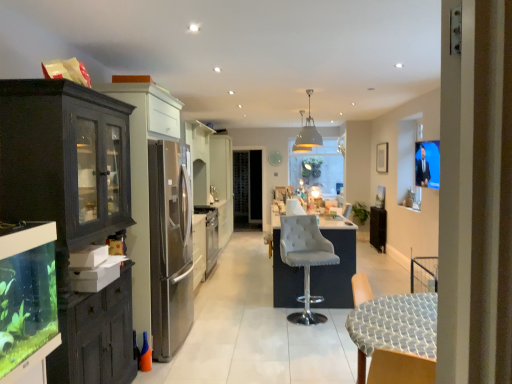
The image size is (512, 384). What do you see at coordinates (210, 236) in the screenshot? I see `satin silver oven at center` at bounding box center [210, 236].

What do you see at coordinates (27, 301) in the screenshot?
I see `clear glass aquarium at left` at bounding box center [27, 301].

Find the location of `satin silver oven at center`. satin silver oven at center is located at coordinates (210, 236).

From a real-world perspective, who is located lower, wooden chair at lower right, which appears as the 1th chair when viewed from the front, or suede-like white bar stool at center, acting as the second chair starting from the front?

wooden chair at lower right, which appears as the 1th chair when viewed from the front.

Is point (352, 283) closer to viewer compared to point (295, 251)?

That is False.

Looking at this image, could you tell me if wooden chair at lower right, which appears as the 1th chair when viewed from the front, is facing suede-like white bar stool at center, acting as the second chair starting from the front?

No, wooden chair at lower right, which appears as the 1th chair when viewed from the front, is not facing towards suede-like white bar stool at center, acting as the second chair starting from the front.

In the scene shown: Which object is positioned more to the left, wooden chair at lower right, arranged as the second chair when viewed from the back, or suede-like white bar stool at center, marked as the first chair in a back-to-front arrangement?

suede-like white bar stool at center, marked as the first chair in a back-to-front arrangement, is more to the left.

Considering the positions of objects clear glass aquarium at left and satin silver oven at center in the image provided, who is more to the right, clear glass aquarium at left or satin silver oven at center?

satin silver oven at center.

From the image's perspective, is clear glass aquarium at left above or below satin silver oven at center?

clear glass aquarium at left is above satin silver oven at center.

Does clear glass aquarium at left come in front of satin silver oven at center?

Yes, it is.

Considering the points (39, 281) and (216, 220), which point is behind, point (39, 281) or point (216, 220)?

The point (216, 220) is farther from the camera.

Can you confirm if matte white pendant light at upper center, arranged as the first lamp when viewed from the front, is positioned to the right of clear glass aquarium at left?

Indeed, matte white pendant light at upper center, arranged as the first lamp when viewed from the front, is positioned on the right side of clear glass aquarium at left.

Does matte white pendant light at upper center, arranged as the first lamp when viewed from the front, have a greater height compared to clear glass aquarium at left?

Indeed, matte white pendant light at upper center, arranged as the first lamp when viewed from the front, has a greater height compared to clear glass aquarium at left.

Is matte white pendant light at upper center, arranged as the first lamp when viewed from the front, situated inside clear glass aquarium at left or outside?

matte white pendant light at upper center, arranged as the first lamp when viewed from the front, is not enclosed by clear glass aquarium at left.

From the image's perspective, is matte white pendant light at upper center, arranged as the first lamp when viewed from the front, positioned above or below clear glass aquarium at left?

Clearly, from the image's perspective, matte white pendant light at upper center, arranged as the first lamp when viewed from the front, is above clear glass aquarium at left.

From a real-world perspective, relative to satin silver oven at center, is metallic gray pendant light at upper center, positioned as the first lamp in back-to-front order, vertically above or below?

Clearly, from a real-world perspective, metallic gray pendant light at upper center, positioned as the first lamp in back-to-front order, is above satin silver oven at center.

Is metallic gray pendant light at upper center, positioned as the first lamp in back-to-front order, facing towards satin silver oven at center?

No.

Can you confirm if metallic gray pendant light at upper center, the second lamp positioned from the front, is bigger than satin silver oven at center?

No.

How distant is metallic gray pendant light at upper center, the second lamp positioned from the front, from satin silver oven at center?

metallic gray pendant light at upper center, the second lamp positioned from the front, and satin silver oven at center are 10.65 feet apart.

How different are the orientations of clear glass aquarium at left and matte white pendant light at upper center, which is the second lamp from back to front, in degrees?

87.8 degrees.

Which point is more distant from viewer, (42,234) or (307,93)?

Point (307,93)

Relative to matte white pendant light at upper center, arranged as the first lamp when viewed from the front, is clear glass aquarium at left in front or behind?

In the image, clear glass aquarium at left appears in front of matte white pendant light at upper center, arranged as the first lamp when viewed from the front.

Is clear glass aquarium at left smaller than matte white pendant light at upper center, arranged as the first lamp when viewed from the front?

No, clear glass aquarium at left is not smaller than matte white pendant light at upper center, arranged as the first lamp when viewed from the front.

From the picture: In terms of size, does matte white pendant light at upper center, which is the second lamp from back to front, appear bigger or smaller than suede-like white bar stool at center, acting as the second chair starting from the front?

Considering their sizes, matte white pendant light at upper center, which is the second lamp from back to front, takes up less space than suede-like white bar stool at center, acting as the second chair starting from the front.

From the image's perspective, which one is positioned lower, matte white pendant light at upper center, arranged as the first lamp when viewed from the front, or suede-like white bar stool at center, acting as the second chair starting from the front?

suede-like white bar stool at center, acting as the second chair starting from the front, is shown below in the image.

Is matte white pendant light at upper center, arranged as the first lamp when viewed from the front, positioned behind suede-like white bar stool at center, acting as the second chair starting from the front?

Yes, matte white pendant light at upper center, arranged as the first lamp when viewed from the front, is further from the camera.

Would you consider matte white pendant light at upper center, arranged as the first lamp when viewed from the front, to be distant from suede-like white bar stool at center, marked as the first chair in a back-to-front arrangement?

Yes.

How many degrees apart are the facing directions of metallic gray pendant light at upper center, positioned as the first lamp in back-to-front order, and clear glass aquarium at left?

metallic gray pendant light at upper center, positioned as the first lamp in back-to-front order, and clear glass aquarium at left are facing 87.8 degrees away from each other.

Measure the distance between metallic gray pendant light at upper center, the second lamp positioned from the front, and clear glass aquarium at left.

metallic gray pendant light at upper center, the second lamp positioned from the front, and clear glass aquarium at left are 7.61 meters apart.

Based on the photo, is metallic gray pendant light at upper center, positioned as the first lamp in back-to-front order, to the left or to the right of clear glass aquarium at left in the image?

metallic gray pendant light at upper center, positioned as the first lamp in back-to-front order, is to the right of clear glass aquarium at left.

From a real-world perspective, is metallic gray pendant light at upper center, positioned as the first lamp in back-to-front order, under clear glass aquarium at left?

No, from a real-world perspective, metallic gray pendant light at upper center, positioned as the first lamp in back-to-front order, is not under clear glass aquarium at left.

Identify the location of chair below the suede-like white bar stool at center, acting as the second chair starting from the front (from a real-world perspective). (393, 335).

At what (x,y) coordinates should I click in order to perform the action: click on appliance that appears below the clear glass aquarium at left (from the image's perspective). Please return your answer as a coordinate pair (x, y). The image size is (512, 384). Looking at the image, I should click on (210, 236).

Which object lies nearer to the anchor point clear glass aquarium at left, matte white pendant light at upper center, arranged as the first lamp when viewed from the front, or metallic gray pendant light at upper center, the second lamp positioned from the front?

matte white pendant light at upper center, arranged as the first lamp when viewed from the front.

Looking at the image, which one is located further to clear glass aquarium at left, suede-like white bar stool at center, marked as the first chair in a back-to-front arrangement, or metallic gray pendant light at upper center, positioned as the first lamp in back-to-front order?

metallic gray pendant light at upper center, positioned as the first lamp in back-to-front order, is further to clear glass aquarium at left.

Based on the photo, considering their positions, is wooden chair at lower right, arranged as the second chair when viewed from the back, positioned closer to matte white pendant light at upper center, arranged as the first lamp when viewed from the front, than satin silver oven at center?

satin silver oven at center is positioned closer to the anchor matte white pendant light at upper center, arranged as the first lamp when viewed from the front.

Looking at the image, which one is located further to satin silver oven at center, matte white pendant light at upper center, arranged as the first lamp when viewed from the front, or wooden chair at lower right, which appears as the 1th chair when viewed from the front?

The object further to satin silver oven at center is wooden chair at lower right, which appears as the 1th chair when viewed from the front.

Looking at the image, which one is located further to clear glass aquarium at left, suede-like white bar stool at center, marked as the first chair in a back-to-front arrangement, or wooden chair at lower right, arranged as the second chair when viewed from the back?

suede-like white bar stool at center, marked as the first chair in a back-to-front arrangement, is further to clear glass aquarium at left.

Looking at the image, which one is located further to matte white pendant light at upper center, which is the second lamp from back to front, metallic gray pendant light at upper center, the second lamp positioned from the front, or satin silver oven at center?

satin silver oven at center is further to matte white pendant light at upper center, which is the second lamp from back to front.

Looking at the image, which one is located closer to suede-like white bar stool at center, marked as the first chair in a back-to-front arrangement, matte white pendant light at upper center, arranged as the first lamp when viewed from the front, or metallic gray pendant light at upper center, the second lamp positioned from the front?

matte white pendant light at upper center, arranged as the first lamp when viewed from the front, is positioned closer to the anchor suede-like white bar stool at center, marked as the first chair in a back-to-front arrangement.

Based on their spatial positions, is matte white pendant light at upper center, arranged as the first lamp when viewed from the front, or suede-like white bar stool at center, acting as the second chair starting from the front, further from satin silver oven at center?

matte white pendant light at upper center, arranged as the first lamp when viewed from the front, is positioned further to the anchor satin silver oven at center.

Locate an element on the screen. The image size is (512, 384). chair between wooden chair at lower right, arranged as the second chair when viewed from the back, and matte white pendant light at upper center, arranged as the first lamp when viewed from the front, from front to back is located at coordinates (305, 259).

Locate an element on the screen. appliance between wooden chair at lower right, which appears as the 1th chair when viewed from the front, and metallic gray pendant light at upper center, positioned as the first lamp in back-to-front order, from front to back is located at coordinates (210, 236).

You are a GUI agent. You are given a task and a screenshot of the screen. Output one action in this format:
    pyautogui.click(x=<x>, y=<y>)
    Task: Click on the lamp between suede-like white bar stool at center, acting as the second chair starting from the front, and satin silver oven at center in the front-back direction
    Image resolution: width=512 pixels, height=384 pixels.
    Given the screenshot: What is the action you would take?
    pyautogui.click(x=308, y=131)

The height and width of the screenshot is (384, 512). What are the coordinates of `appliance located between matte white pendant light at upper center, which is the second lamp from back to front, and metallic gray pendant light at upper center, positioned as the first lamp in back-to-front order, in the depth direction` in the screenshot? It's located at (210, 236).